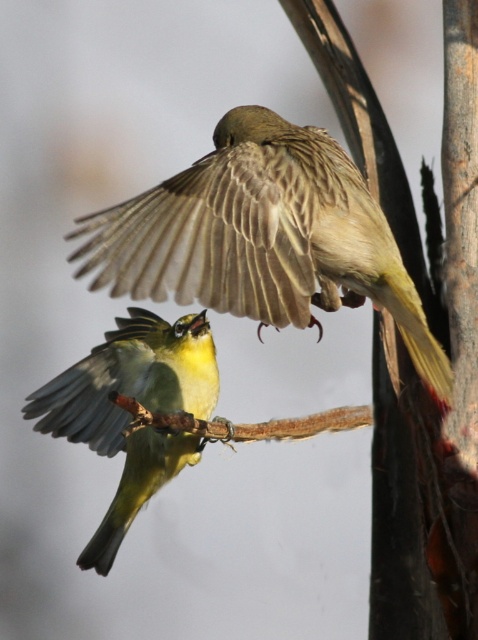
You are observing two points in the image. The first point is at coordinates point (207, 182) and the second is at point (128, 500). Which of these points is nearer to the camera?

Point (207, 182) is closer to the camera than point (128, 500).